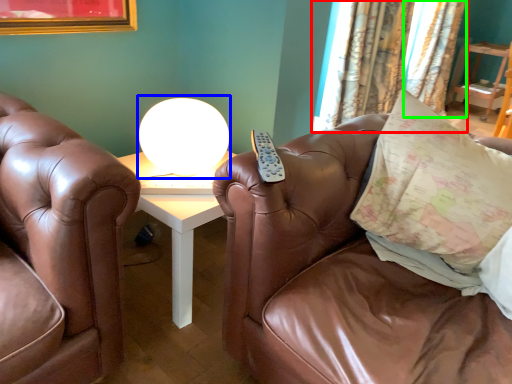
Question: Considering the real-world distances, which object is farthest from curtain (highlighted by a red box)? table lamp (highlighted by a blue box) or curtain (highlighted by a green box)?

Choices:
 (A) table lamp
 (B) curtain

Answer: (A)